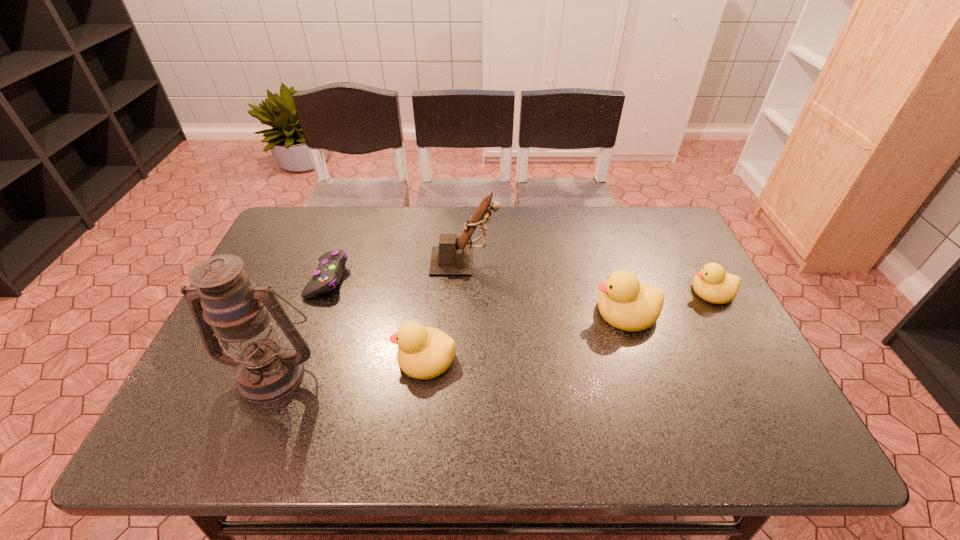
Locate an element on the screen. This screenshot has height=540, width=960. spot to insert another duckling for uniform distribution is located at coordinates (530, 334).